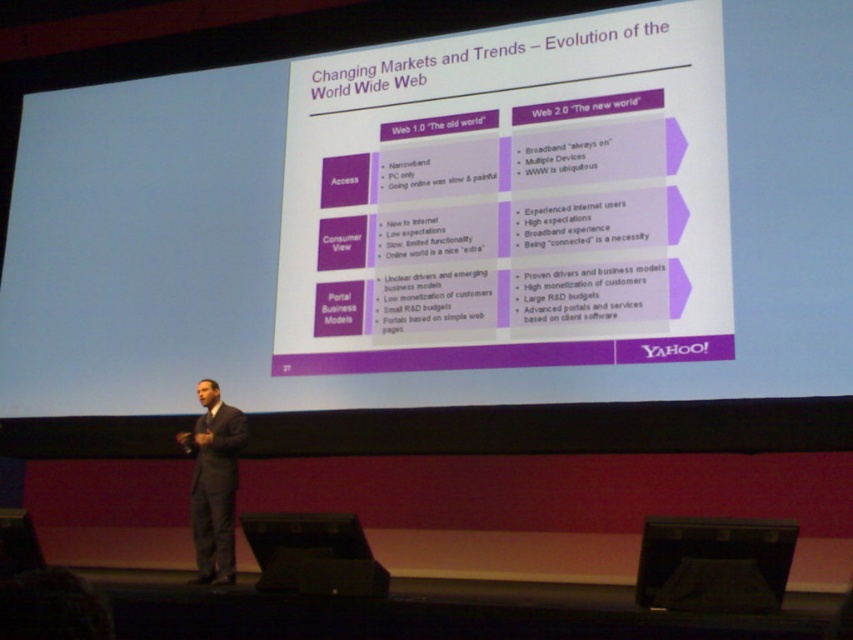
You are an attendee sitting in the front row of the presentation. You need to quickly jot down a note on your phone but want to ensure you can still see the white matte projection screen at upper center without turning your head. Can you do this while looking at the black matte laptop at center on the stage?

The white matte projection screen at upper center is further to the viewer than the black matte laptop at center, so yes, you can see both the white matte projection screen at upper center and the black matte laptop at center simultaneously without turning your head because the projection screen is positioned in front of the laptop.

You are standing in the audience and want to take a photo of the white matte projection screen at upper center. Your camera has a maximum focus range of 6 meters. Will you be able to focus on the screen?

The white matte projection screen at upper center is 6.47 meters from viewer. Since the camera can only focus up to 6 meters, it won not be able to focus on the screen.